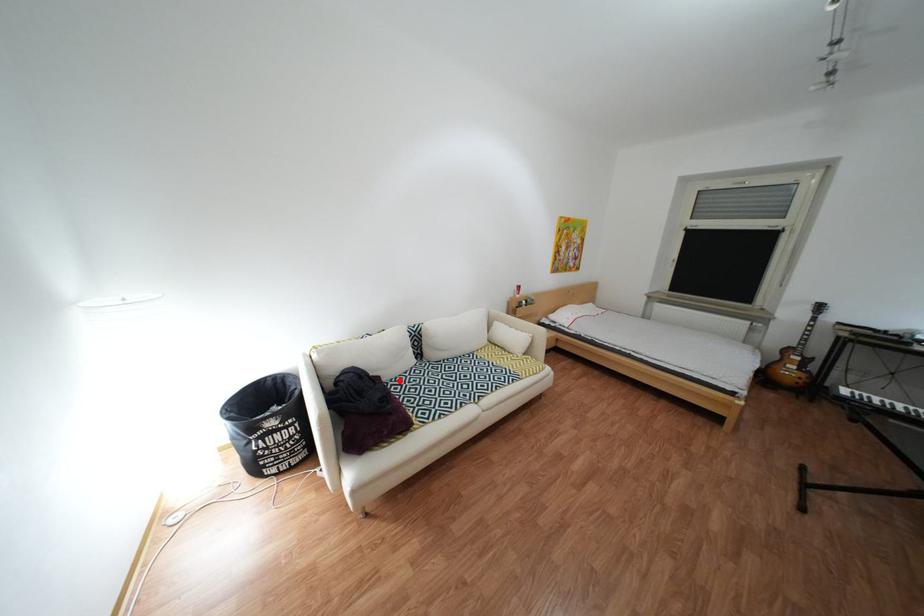
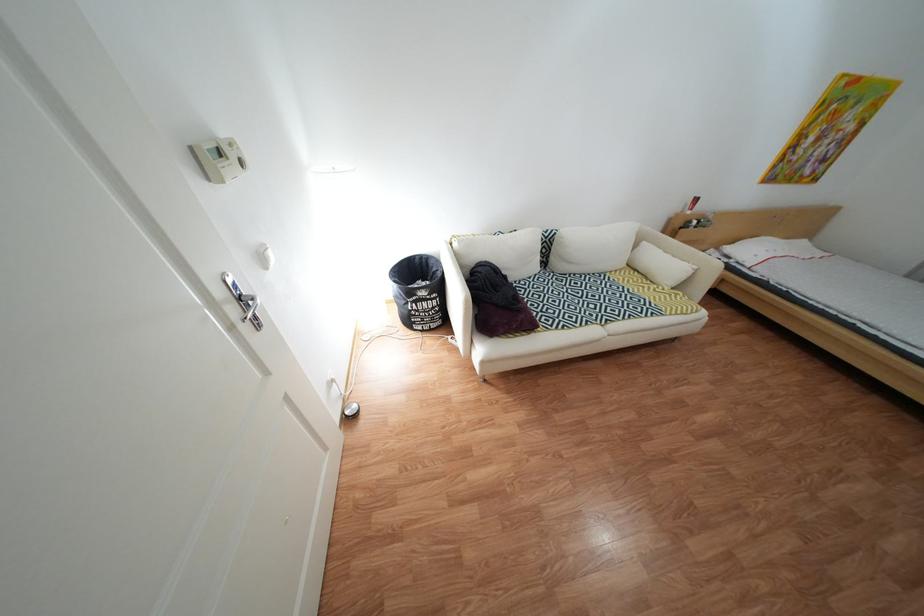
Question: I am providing you with two images of the same scene from different viewpoints. Given a red point in image1, look at the same physical point in image2. Is it:

Choices:
 (A) Closer to the viewpoint
 (B) Farther from the viewpoint

Answer: (B)